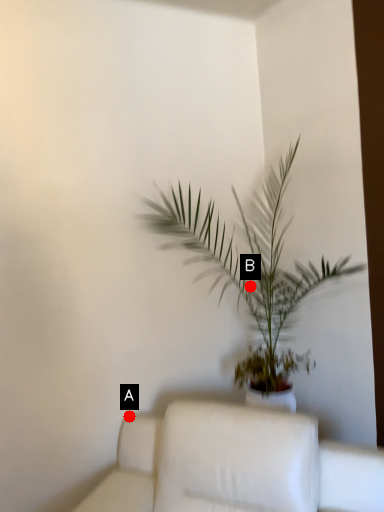
Question: Two points are circled on the image, labeled by A and B beside each circle. Which point is further to the camera?

Choices:
 (A) A is further
 (B) B is further

Answer: (B)